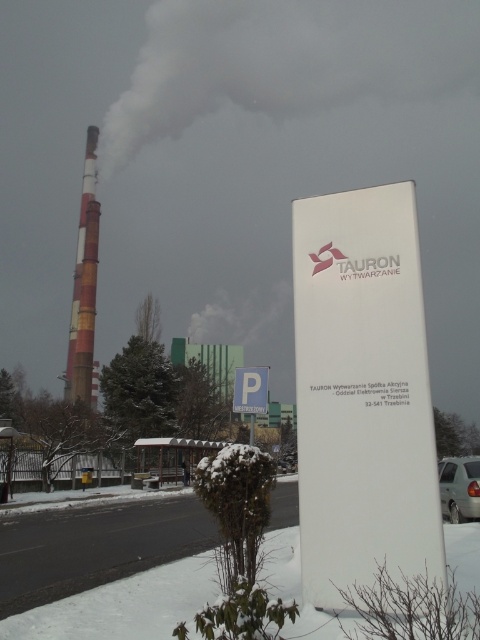
Is red and white striped chimney at left to the right of blue plastic parking sign at center from the viewer's perspective?

Incorrect, red and white striped chimney at left is not on the right side of blue plastic parking sign at center.

Between red and white striped chimney at left and blue plastic parking sign at center, which one is positioned lower?

blue plastic parking sign at center is below.

Between point (92, 170) and point (267, 369), which one is positioned in front?

Positioned in front is point (267, 369).

The image size is (480, 640). I want to click on red and white striped chimney at left, so (x=84, y=284).

Does white matte van at lower right have a greater height compared to blue plastic parking sign at center?

Yes, white matte van at lower right is taller than blue plastic parking sign at center.

Is point (479, 486) closer to camera compared to point (252, 372)?

That is False.

Is point (454, 486) farther from camera compared to point (236, 410)?

Yes, it is.

What are the coordinates of `white matte van at lower right` in the screenshot? It's located at (459, 486).

Does point (314, 323) lie behind point (451, 492)?

No, it is not.

Does white plastic sign at center appear on the right side of white matte van at lower right?

Incorrect, white plastic sign at center is not on the right side of white matte van at lower right.

This screenshot has height=640, width=480. I want to click on white plastic sign at center, so click(x=362, y=392).

Identify the location of white plastic sign at center. This screenshot has height=640, width=480. (362, 392).